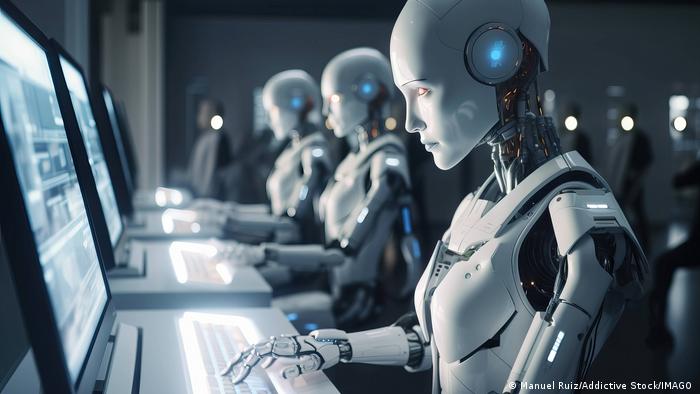
Locate an element on the screen. The width and height of the screenshot is (700, 394). computer keyboard is located at coordinates (167, 184), (174, 217), (195, 274), (209, 337).